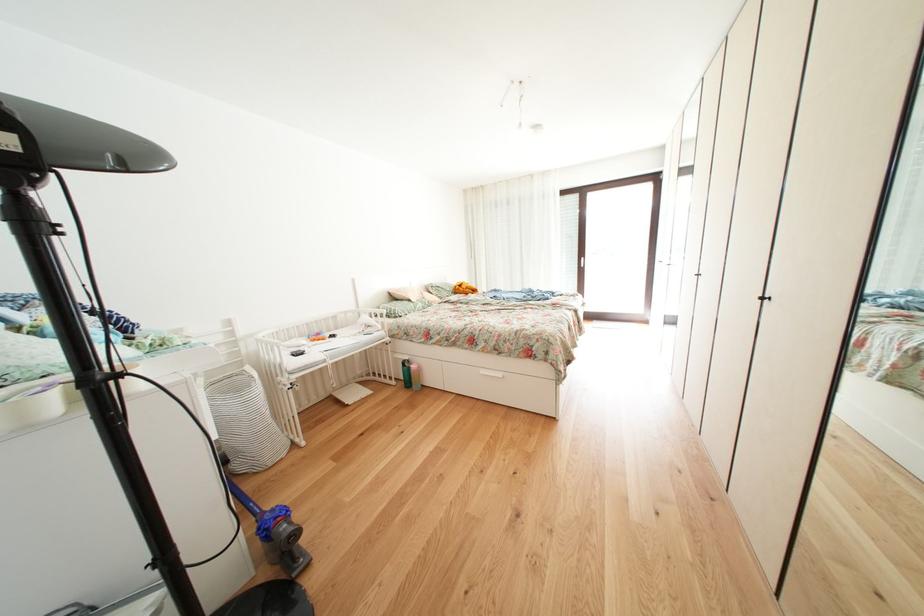
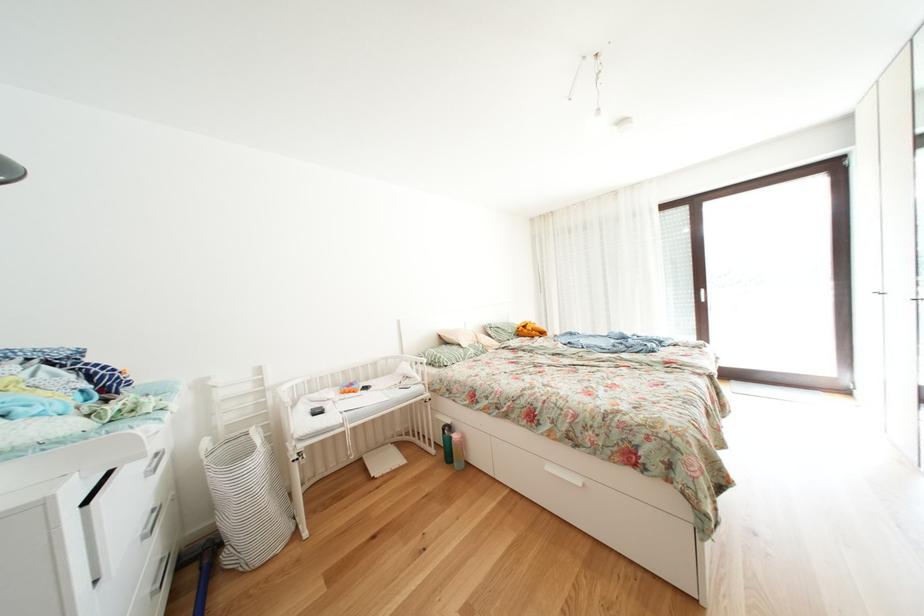
Find the pixel in the second image that matches pixel 492 377 in the first image.

(558, 472)